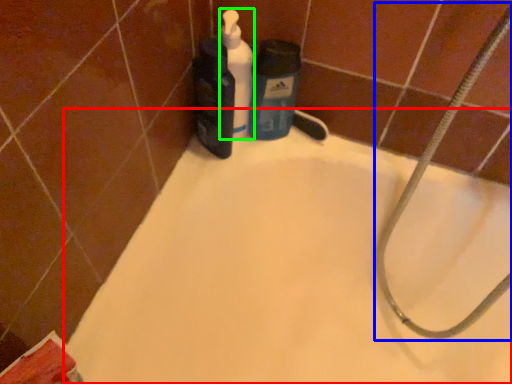
Question: Based on their relative distances, which object is nearer to bathtub (highlighted by a red box)? Choose from garden hose (highlighted by a blue box) and cleaning product (highlighted by a green box).

Choices:
 (A) garden hose
 (B) cleaning product

Answer: (A)